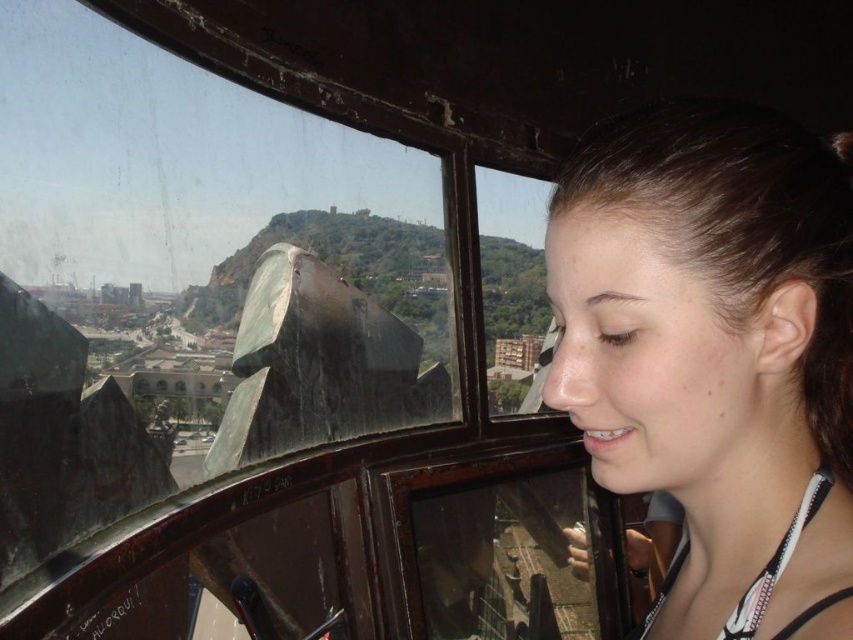
Can you confirm if transparent glass window at center is smaller than smooth brown hair at right?

No, transparent glass window at center is not smaller than smooth brown hair at right.

Who is positioned more to the left, transparent glass window at center or smooth brown hair at right?

transparent glass window at center is more to the left.

Identify the location of transparent glass window at center. Image resolution: width=853 pixels, height=640 pixels. (291, 321).